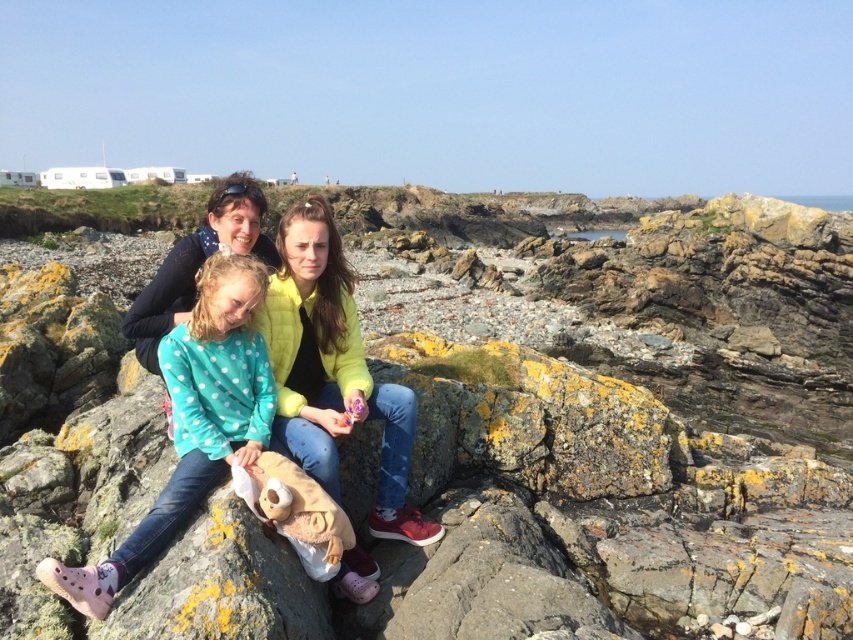
You are standing at the point marked as point (582, 252) in the image. A drone needs to hover exactly 100 feet above your current position. How high should the drone ascend from the ground to achieve this?

The point (582, 252) is 271.89 feet away from the viewer. To hover 100 feet above this point, the drone should ascend to an altitude of 271.89 feet plus 100 feet, totaling 371.89 feet above ground level.